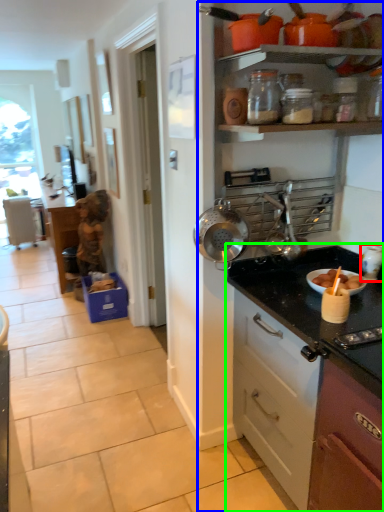
Question: Which is farther away from appliance (highlighted by a red box)? dresser (highlighted by a blue box) or countertop (highlighted by a green box)?

Choices:
 (A) dresser
 (B) countertop

Answer: (A)